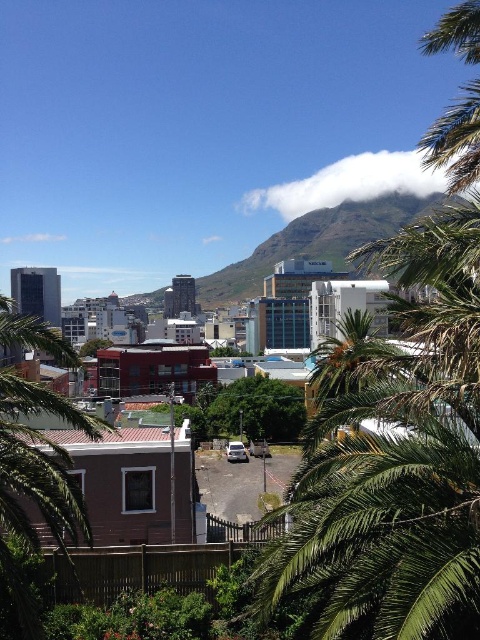
Question: Is green grassy mountain at center smaller than white fluffy cloud at upper center?

Choices:
 (A) no
 (B) yes

Answer: (A)

Question: Which point is farther to the camera?

Choices:
 (A) green leafy palm tree at center
 (B) white fluffy cloud at upper center
 (C) green grassy mountain at center

Answer: (B)

Question: Which point is farther from the camera taking this photo?

Choices:
 (A) tap(247, 208)
 (B) tap(387, 618)
 (C) tap(323, 209)

Answer: (A)

Question: Which object is the farthest from the green grassy mountain at center?

Choices:
 (A) white fluffy cloud at upper center
 (B) green leafy palm tree at center

Answer: (B)

Question: Is green leafy palm tree at center above white fluffy cloud at upper center?

Choices:
 (A) no
 (B) yes

Answer: (A)

Question: In this image, where is green leafy palm tree at center located relative to white fluffy cloud at upper center?

Choices:
 (A) right
 (B) left

Answer: (B)